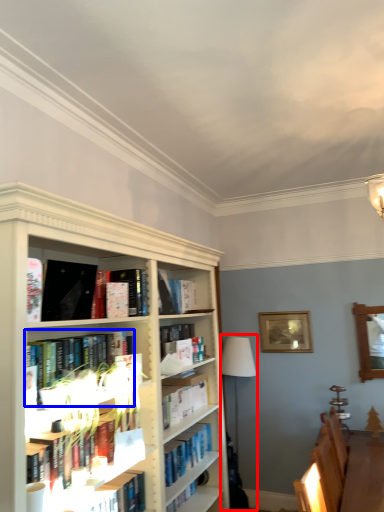
Question: Which point is closer to the camera, lamp (highlighted by a red box) or book (highlighted by a blue box)?

Choices:
 (A) lamp
 (B) book

Answer: (B)